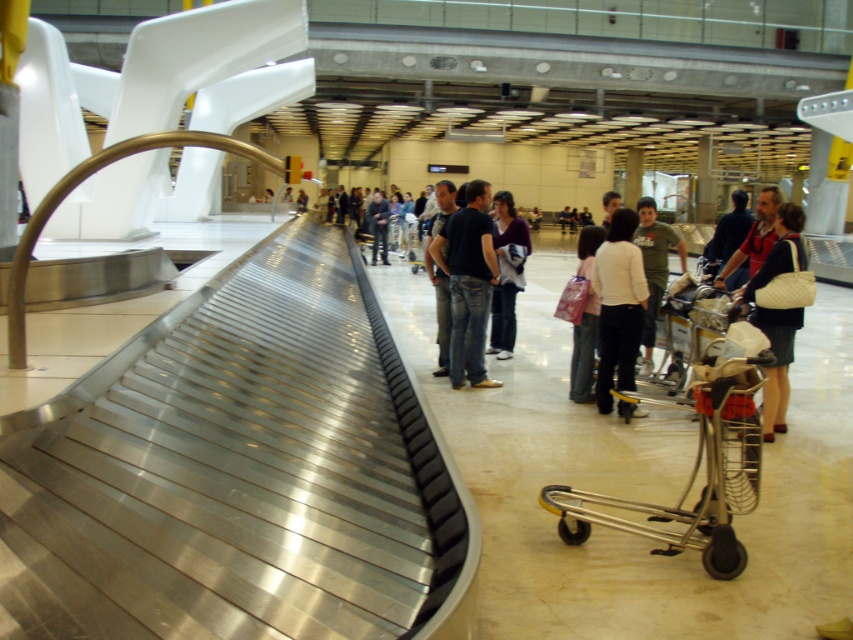
Question: Which object is farther from the camera taking this photo?

Choices:
 (A) jeans at center
 (B) green t-shirt at center
 (C) black jeans at center

Answer: (C)

Question: Is black jeans at center wider than dark blue shirt at center?

Choices:
 (A) no
 (B) yes

Answer: (A)

Question: Considering the relative positions of white textured handbag at center and smooth skin face at center in the image provided, where is white textured handbag at center located with respect to smooth skin face at center?

Choices:
 (A) below
 (B) above

Answer: (A)

Question: Where is jeans at center located in relation to dark blue jeans at center in the image?

Choices:
 (A) right
 (B) left

Answer: (A)

Question: Which of the following is the closest to the observer?

Choices:
 (A) (613, 333)
 (B) (608, 225)

Answer: (A)

Question: Which point is closer to the camera?

Choices:
 (A) silver metallic shopping cart at center
 (B) white matte sweater at center

Answer: (A)